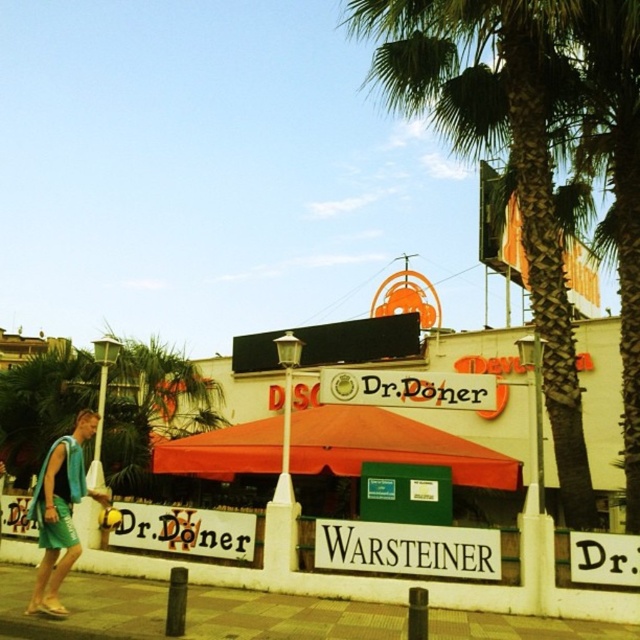
Which is behind, point (211, 588) or point (60, 561)?

The point (211, 588) is more distant.

Is point (132, 611) positioned behind point (52, 524)?

No, it is in front of (52, 524).

Describe the element at coordinates (288, 616) in the screenshot. I see `brown brick pavement at lower center` at that location.

Image resolution: width=640 pixels, height=640 pixels. I want to click on brown brick pavement at lower center, so click(288, 616).

Between green leafy palm tree at upper center and brown brick pavement at lower center, which one appears on the right side from the viewer's perspective?

green leafy palm tree at upper center

Is point (577, 515) closer to camera compared to point (51, 636)?

That is False.

Where is `green leafy palm tree at upper center`? The height and width of the screenshot is (640, 640). green leafy palm tree at upper center is located at coordinates (508, 156).

Can you confirm if green leafy palm tree at upper center is thinner than green fabric towel at lower left?

No, green leafy palm tree at upper center is not thinner than green fabric towel at lower left.

Is green leafy palm tree at upper center shorter than green fabric towel at lower left?

No, green leafy palm tree at upper center is not shorter than green fabric towel at lower left.

Is point (509, 0) in front of point (61, 490)?

That is False.

The image size is (640, 640). In order to click on green leafy palm tree at upper center in this screenshot , I will do `click(508, 156)`.